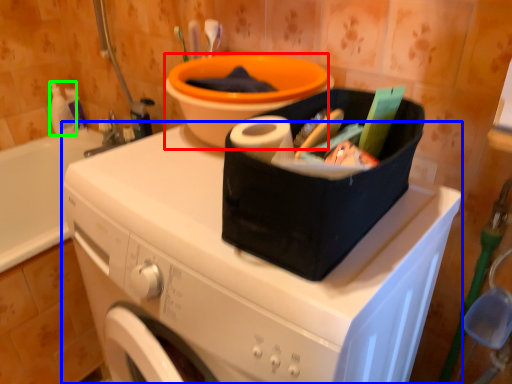
Question: Which object is the farthest from basin (highlighted by a red box)? Choose among these: washing machine (highlighted by a blue box) or cleaning product (highlighted by a green box).

Choices:
 (A) washing machine
 (B) cleaning product

Answer: (B)